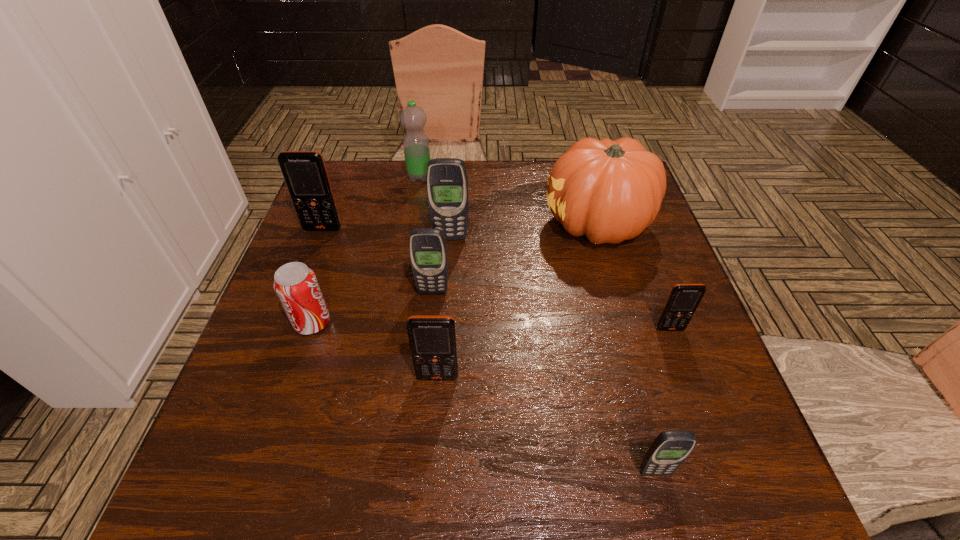
The image size is (960, 540). I want to click on green water bottle, so click(x=413, y=118).

You are a GUI agent. You are given a task and a screenshot of the screen. Output one action in this format:
    pyautogui.click(x=<x>, y=<y>)
    Task: Click on the water bottle
    This screenshot has width=960, height=540.
    Given the screenshot: What is the action you would take?
    pyautogui.click(x=413, y=118)

Locate an element on the screen. The width and height of the screenshot is (960, 540). pumpkin is located at coordinates (610, 191).

Where is `the leftmost orange cellular telephone`? This screenshot has width=960, height=540. the leftmost orange cellular telephone is located at coordinates pyautogui.click(x=305, y=174).

Identify the location of the farthest orange cellular telephone. (305, 174).

Image resolution: width=960 pixels, height=540 pixels. Identify the location of the farthest gray cellular telephone. (446, 180).

Where is `the biggest gray cellular telephone`? The width and height of the screenshot is (960, 540). the biggest gray cellular telephone is located at coordinates (446, 180).

Locate an element on the screen. The height and width of the screenshot is (540, 960). the fifth nearest object is located at coordinates (428, 253).

This screenshot has width=960, height=540. What are the coordinates of `the second nearest gray cellular telephone` in the screenshot? It's located at (428, 253).

This screenshot has width=960, height=540. I want to click on the second smallest orange cellular telephone, so click(432, 338).